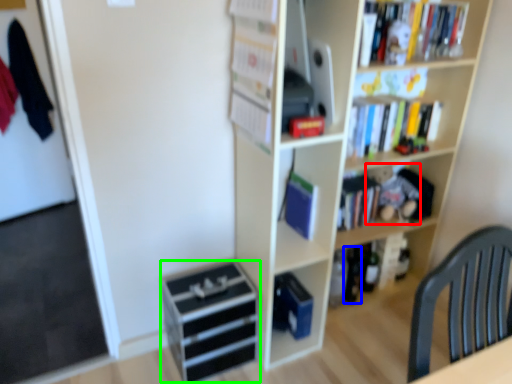
Question: Which object is positioned closest to toy (highlighted by a red box)? Select from beer bottle (highlighted by a blue box) and drawer (highlighted by a green box).

Choices:
 (A) beer bottle
 (B) drawer

Answer: (A)